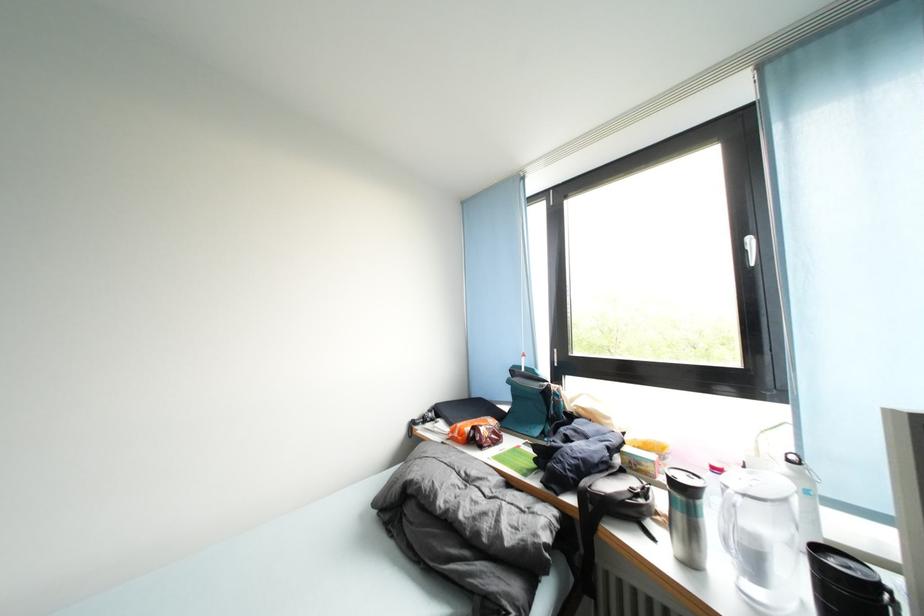
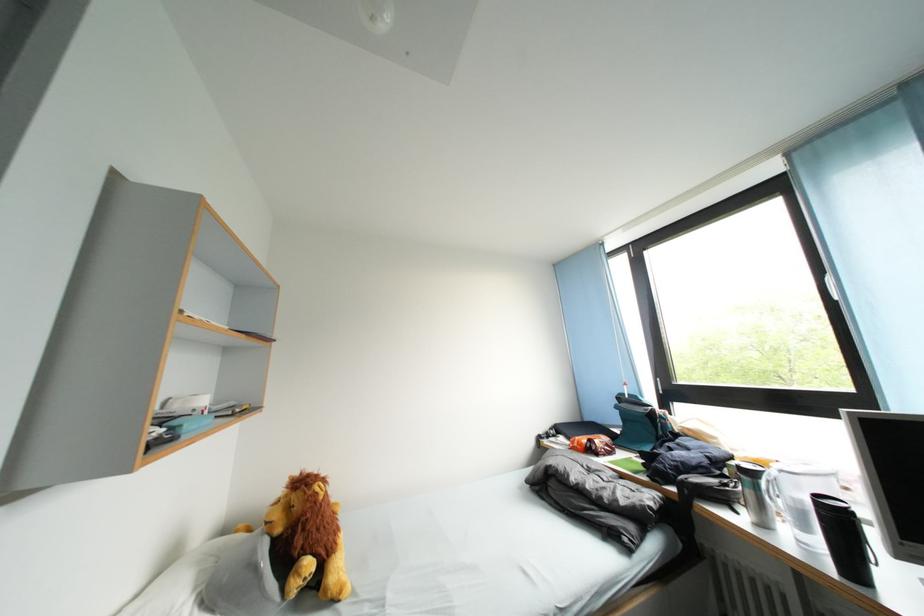
Where in the second image is the point corresponding to [482,446] from the first image?

(600, 455)